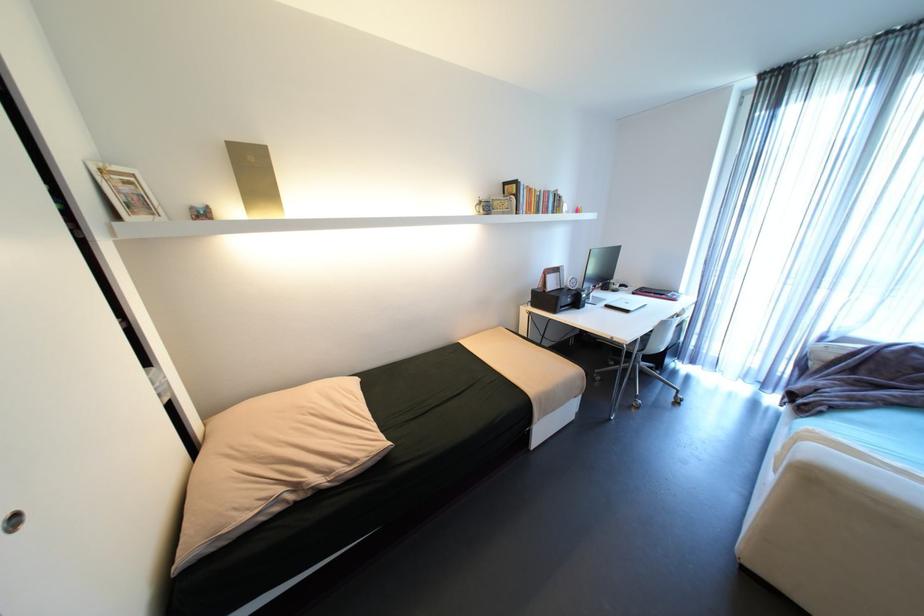
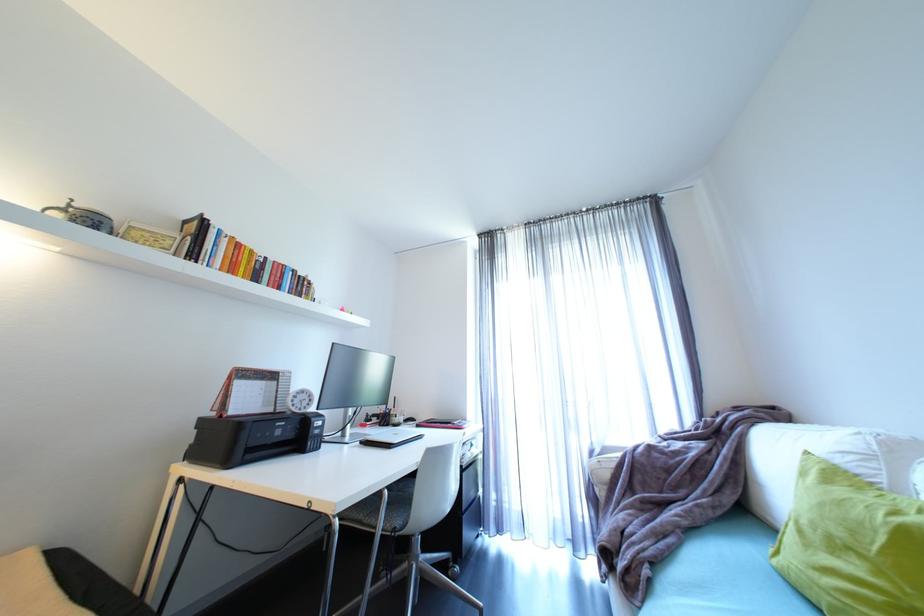
Question: I am providing you with two images of the same scene from different viewpoints. Which of the following objects are not visible in image2?

Choices:
 (A) green pillow
 (B) patterned mug
 (C) chair sitting surface
 (D) none of these

Answer: (D)